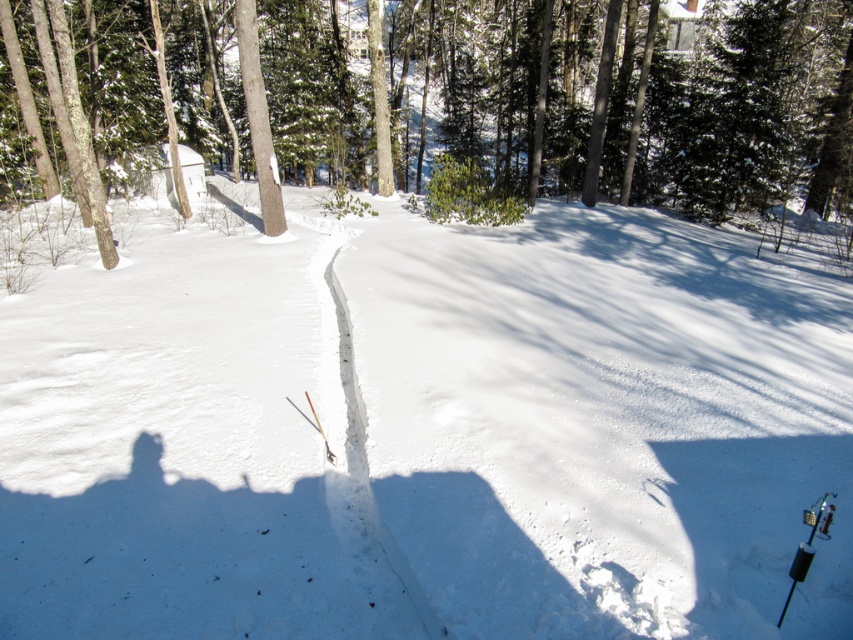
You are a hiker trying to navigate through the snowy forest. You see a brown smooth tree at upper center and a white snow trail at center. Which object is positioned higher in the image?

The brown smooth tree at upper center is located above the white snow trail at center in the image.

You are standing at the point marked by point (x=630, y=99) in the snowy forest scene. Looking around, you see a brown smooth tree at upper center. Which direction should you face to see the cleared path running through the center of the image?

The point (x=630, y=99) indicates the brown smooth tree at upper center. Since the cleared path runs through the center of the image, facing downward from the tree would direct your view toward the center, allowing you to see the path.